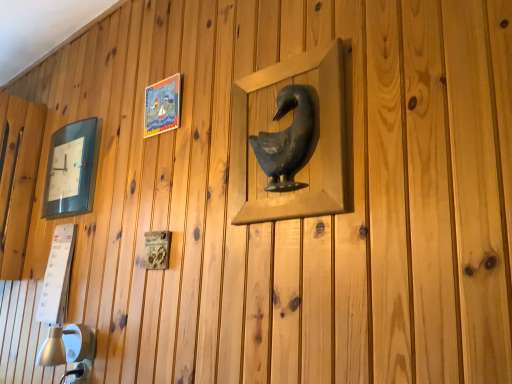
Question: From the image's perspective, is matte plastic picture frame at upper left, the second picture frame when ordered from front to back, positioned above or below metallic gray bird at center, arranged as the 3th picture frame when viewed from the back?

Choices:
 (A) below
 (B) above

Answer: (B)

Question: From a real-world perspective, is matte plastic picture frame at upper left, marked as the 2th picture frame in a right-to-left arrangement, above or below metallic gray bird at center, arranged as the 3th picture frame when viewed from the back?

Choices:
 (A) above
 (B) below

Answer: (A)

Question: Which of these objects is positioned closest to the matte plastic picture frame at upper left, marked as the 2th picture frame in a right-to-left arrangement?

Choices:
 (A) matte black clock at left, placed as the third picture frame when sorted from front to back
 (B) metallic gray bird at center, the first picture frame when ordered from right to left

Answer: (A)

Question: Estimate the real-world distances between objects in this image. Which object is closer to the matte black clock at left, the first picture frame from the back?

Choices:
 (A) metallic gray bird at center, which is the third picture frame from left to right
 (B) matte plastic picture frame at upper left, marked as the 2th picture frame in a right-to-left arrangement

Answer: (B)